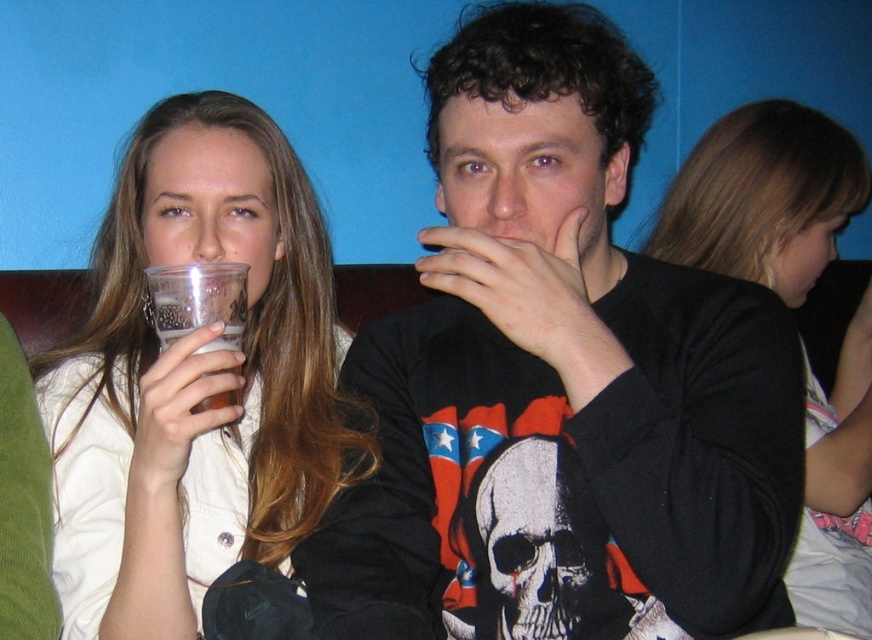
Between blonde hair at upper right and translucent plastic cup at center, which one has less height?

With less height is translucent plastic cup at center.

Does blonde hair at upper right have a larger size compared to translucent plastic cup at center?

Correct, blonde hair at upper right is larger in size than translucent plastic cup at center.

What are the coordinates of `blonde hair at upper right` in the screenshot? It's located at (763, 196).

Between clear plastic cup at left and translucent plastic cup at center, which one is positioned lower?

translucent plastic cup at center is lower down.

Between point (281, 227) and point (235, 337), which one is positioned behind?

Point (281, 227)

Image resolution: width=872 pixels, height=640 pixels. I want to click on clear plastic cup at left, so click(195, 380).

Does black matte sweatshirt at center appear over blonde hair at upper right?

Yes.

Can you confirm if black matte sweatshirt at center is thinner than blonde hair at upper right?

No, black matte sweatshirt at center is not thinner than blonde hair at upper right.

Which is behind, point (630, 468) or point (864, 445)?

The point (864, 445) is more distant.

This screenshot has height=640, width=872. Find the location of `black matte sweatshirt at center`. black matte sweatshirt at center is located at coordinates (560, 384).